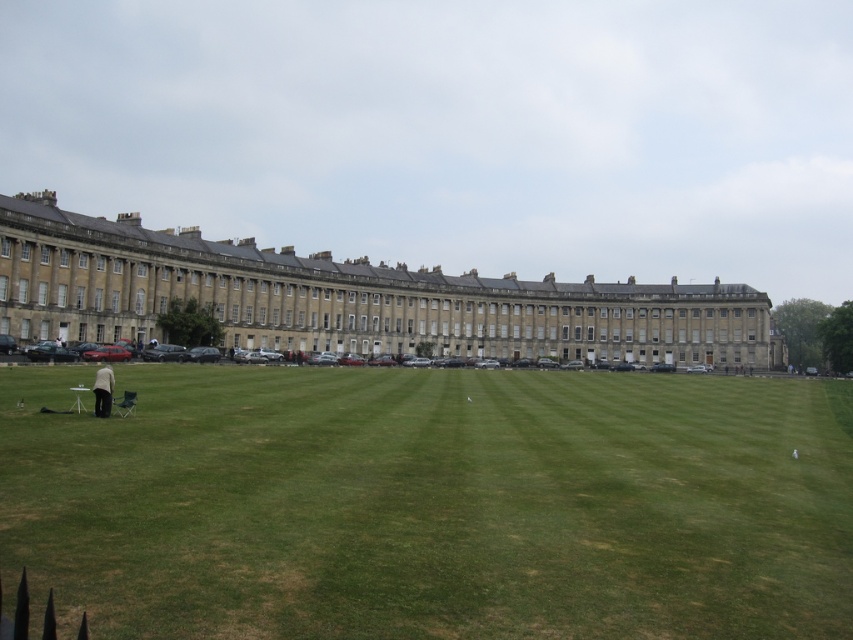
Does point (54, 589) come farther from viewer compared to point (401, 285)?

No, (54, 589) is in front of (401, 285).

Between point (790, 488) and point (720, 358), which one is positioned in front?

Point (790, 488)

Locate an element on the screen. The height and width of the screenshot is (640, 853). green grass at center is located at coordinates (431, 502).

Does green grass at center have a greater height compared to light beige fabric jacket at lower left?

Yes, green grass at center is taller than light beige fabric jacket at lower left.

Is point (746, 605) closer to viewer compared to point (106, 384)?

Yes, it is in front of point (106, 384).

Where is `green grass at center`? green grass at center is located at coordinates (431, 502).

Can you confirm if beige stone palace at center is smaller than light beige fabric jacket at lower left?

No.

Measure the distance between point (6,294) and camera.

Point (6,294) and camera are 70.39 meters apart.

Is point (148, 278) in front of point (106, 392)?

No, (148, 278) is further to viewer.

Locate an element on the screen. beige stone palace at center is located at coordinates (347, 298).